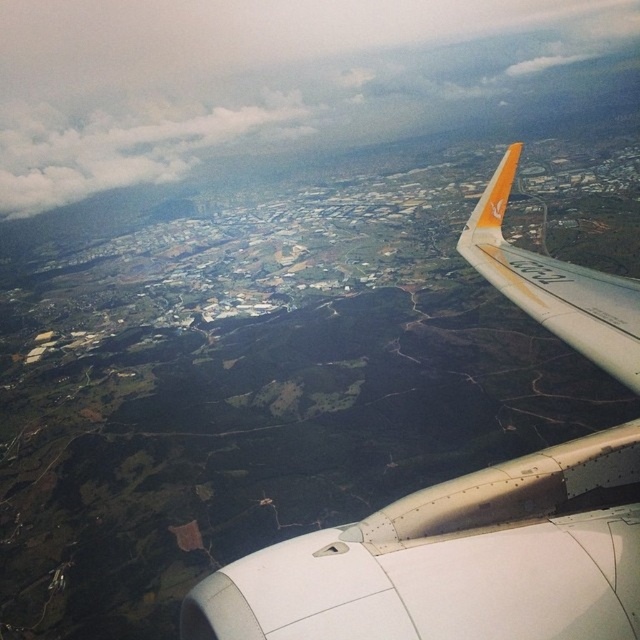
Can you confirm if white fluffy cloud at upper center is positioned below white fluffy cloud at upper left?

No.

Can you confirm if white fluffy cloud at upper center is positioned above white fluffy cloud at upper left?

Yes.

Find the location of a particular element. This screenshot has height=640, width=640. white fluffy cloud at upper center is located at coordinates (253, 77).

Is white matte airplane wing at upper right wider than white fluffy cloud at upper left?

Incorrect, white matte airplane wing at upper right's width does not surpass white fluffy cloud at upper left's.

Which is in front, point (316, 628) or point (74, 195)?

Point (316, 628) is more forward.

I want to click on white matte airplane wing at upper right, so click(454, 561).

Where is `white matte airplane wing at upper right`? This screenshot has height=640, width=640. white matte airplane wing at upper right is located at coordinates (454, 561).

Is white fluffy cloud at upper left taller than orange matte winglet at upper right?

Yes.

Locate an element on the screen. white fluffy cloud at upper left is located at coordinates (132, 147).